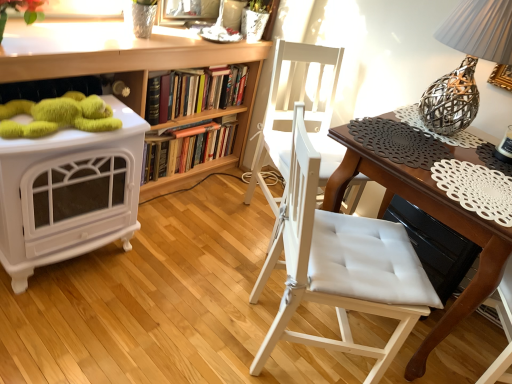
Question: From a real-world perspective, does white padded chair at center, acting as the 1th chair starting from the back, stand above hardcover book at center, which is the 1th book in bottom-to-top order?

Choices:
 (A) yes
 (B) no

Answer: (A)

Question: Could you tell me if white padded chair at center, the 2th chair positioned from the front, is turned towards hardcover book at center, which is counted as the second book, starting from the top?

Choices:
 (A) no
 (B) yes

Answer: (A)

Question: Is white padded chair at center, acting as the 1th chair starting from the back, closer to camera compared to hardcover book at center, which is the 1th book in bottom-to-top order?

Choices:
 (A) no
 (B) yes

Answer: (B)

Question: Can you confirm if white padded chair at center, the 2th chair positioned from the front, is bigger than hardcover book at center, which is the 1th book in bottom-to-top order?

Choices:
 (A) no
 (B) yes

Answer: (B)

Question: Can you confirm if white padded chair at center, the 2th chair positioned from the front, is positioned to the left of hardcover book at center, which is counted as the second book, starting from the top?

Choices:
 (A) yes
 (B) no

Answer: (B)

Question: From the image's perspective, relative to hardcover book at center, which is counted as the second book, starting from the top, is hardcover books at center, arranged as the first book when viewed from the top, above or below?

Choices:
 (A) above
 (B) below

Answer: (A)

Question: Is point (164, 74) positioned closer to the camera than point (145, 162)?

Choices:
 (A) farther
 (B) closer

Answer: (B)

Question: Is hardcover books at center, arranged as the first book when viewed from the top, wider or thinner than hardcover book at center, which is counted as the second book, starting from the top?

Choices:
 (A) wide
 (B) thin

Answer: (B)

Question: In terms of size, does hardcover books at center, arranged as the first book when viewed from the top, appear bigger or smaller than hardcover book at center, which is the 1th book in bottom-to-top order?

Choices:
 (A) big
 (B) small

Answer: (B)

Question: From a real-world perspective, relative to woven metallic lampshade at upper right, is white padded chair at center, positioned as the 1th chair in front-to-back order, vertically above or below?

Choices:
 (A) below
 (B) above

Answer: (A)

Question: Is white padded chair at center, positioned as the second chair in back-to-front order, inside the boundaries of woven metallic lampshade at upper right, or outside?

Choices:
 (A) outside
 (B) inside

Answer: (A)

Question: Is white padded chair at center, positioned as the second chair in back-to-front order, bigger or smaller than woven metallic lampshade at upper right?

Choices:
 (A) small
 (B) big

Answer: (B)

Question: Is white padded chair at center, positioned as the second chair in back-to-front order, wider or thinner than woven metallic lampshade at upper right?

Choices:
 (A) wide
 (B) thin

Answer: (A)

Question: From their relative heights in the image, would you say hardcover books at center, arranged as the first book when viewed from the top, is taller or shorter than woven metallic lampshade at upper right?

Choices:
 (A) tall
 (B) short

Answer: (B)

Question: Looking at their shapes, would you say hardcover books at center, arranged as the first book when viewed from the top, is wider or thinner than woven metallic lampshade at upper right?

Choices:
 (A) wide
 (B) thin

Answer: (B)